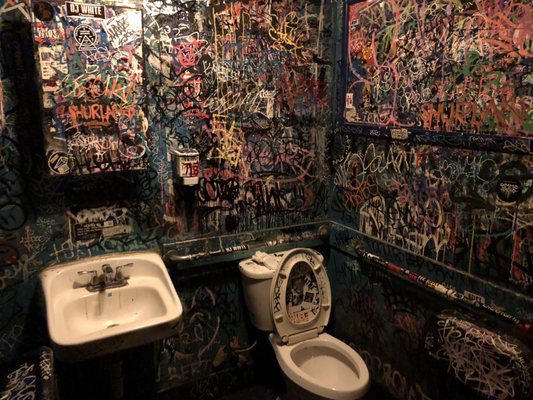
I want to click on left underside of toilet seat, so click(x=324, y=285).